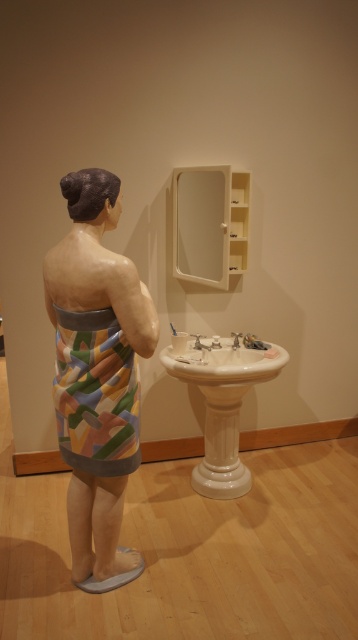
Question: Can you confirm if painted fabric towel at center is positioned above white glossy sink at lower center?

Choices:
 (A) no
 (B) yes

Answer: (B)

Question: From the image, what is the correct spatial relationship of white glossy sink at lower center in relation to white porcelain sink at lower center?

Choices:
 (A) left
 (B) right

Answer: (A)

Question: Does white glossy sink at lower center have a greater width compared to silver metallic faucet at sink center?

Choices:
 (A) yes
 (B) no

Answer: (A)

Question: Estimate the real-world distances between objects in this image. Which object is farther from the white glossy sink at lower center?

Choices:
 (A) painted fabric towel at center
 (B) silver metallic faucet at sink center
 (C) silver metallic faucet at lower center
 (D) white porcelain sink at lower center

Answer: (A)

Question: Which object appears farthest from the camera in this image?

Choices:
 (A) silver metallic faucet at lower center
 (B) painted fabric towel at center

Answer: (A)

Question: Which point appears farthest from the camera in this image?

Choices:
 (A) (233, 342)
 (B) (204, 353)

Answer: (A)